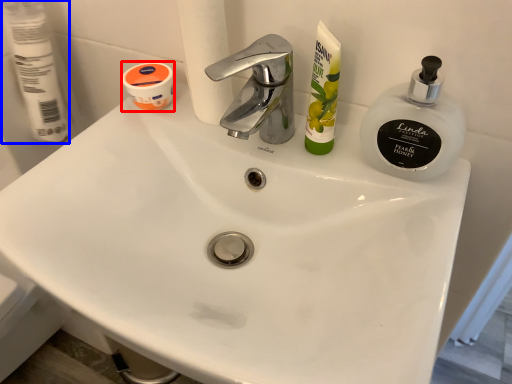
Question: Which point is closer to the camera, mouthwash (highlighted by a red box) or toilet paper (highlighted by a blue box)?

Choices:
 (A) mouthwash
 (B) toilet paper

Answer: (B)